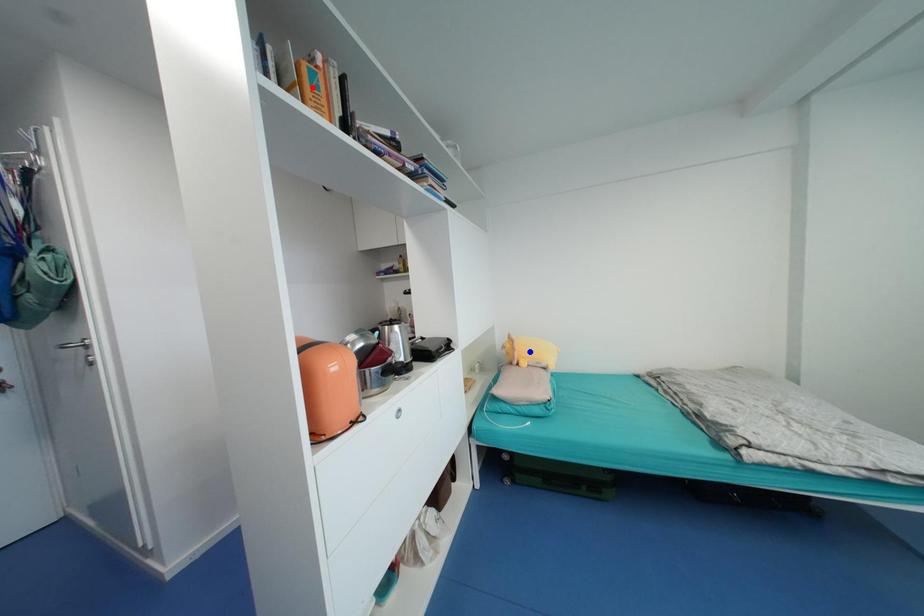
Question: Which of the two points in the image is closer to the camera?

Choices:
 (A) Blue point is closer.
 (B) Red point is closer.

Answer: (B)